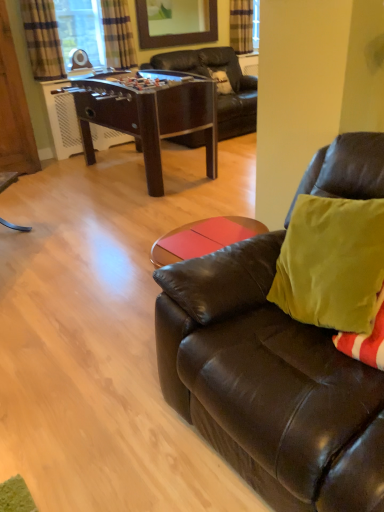
Question: Is wooden frame mirror at upper center facing away from plaid fabric curtain at upper left, which is the 2th curtain in left-to-right order?

Choices:
 (A) yes
 (B) no

Answer: (B)

Question: Is wooden frame mirror at upper center bigger than plaid fabric curtain at upper left, the second curtain from the front?

Choices:
 (A) yes
 (B) no

Answer: (B)

Question: Is wooden frame mirror at upper center touching plaid fabric curtain at upper left, which is the 2th curtain in left-to-right order?

Choices:
 (A) yes
 (B) no

Answer: (B)

Question: Does wooden frame mirror at upper center have a greater width compared to plaid fabric curtain at upper left, the second curtain from the front?

Choices:
 (A) no
 (B) yes

Answer: (A)

Question: Is wooden frame mirror at upper center taller than plaid fabric curtain at upper left, the second curtain from the front?

Choices:
 (A) yes
 (B) no

Answer: (B)

Question: Considering the relative positions of plaid fabric curtain at upper left, positioned as the 3th curtain in right-to-left order, and wooden frame mirror at upper center in the image provided, is plaid fabric curtain at upper left, positioned as the 3th curtain in right-to-left order, to the left or to the right of wooden frame mirror at upper center?

Choices:
 (A) left
 (B) right

Answer: (A)

Question: From the image's perspective, relative to wooden frame mirror at upper center, is plaid fabric curtain at upper left, placed as the first curtain when sorted from front to back, above or below?

Choices:
 (A) above
 (B) below

Answer: (B)

Question: In the image, is plaid fabric curtain at upper left, positioned as the 3th curtain in right-to-left order, positioned in front of or behind wooden frame mirror at upper center?

Choices:
 (A) front
 (B) behind

Answer: (A)

Question: Looking at their shapes, would you say plaid fabric curtain at upper left, positioned as the 1th curtain in left-to-right order, is wider or thinner than wooden frame mirror at upper center?

Choices:
 (A) thin
 (B) wide

Answer: (B)

Question: Based on their positions, is plaid fabric curtain at upper center, which is counted as the third curtain, starting from the left, located to the left or right of plaid fabric curtain at upper left, positioned as the 3th curtain in right-to-left order?

Choices:
 (A) left
 (B) right

Answer: (B)

Question: Is plaid fabric curtain at upper center, the 1th curtain when ordered from right to left, bigger or smaller than plaid fabric curtain at upper left, positioned as the 3th curtain in right-to-left order?

Choices:
 (A) big
 (B) small

Answer: (B)

Question: Considering their positions, is plaid fabric curtain at upper center, the first curtain viewed from the back, located in front of or behind plaid fabric curtain at upper left, the 3th curtain when ordered from back to front?

Choices:
 (A) front
 (B) behind

Answer: (B)

Question: Looking at their shapes, would you say plaid fabric curtain at upper center, which is counted as the third curtain, starting from the left, is wider or thinner than plaid fabric curtain at upper left, placed as the first curtain when sorted from front to back?

Choices:
 (A) wide
 (B) thin

Answer: (B)

Question: Is brown wooden foosball table at center to the left or to the right of wooden frame mirror at upper center in the image?

Choices:
 (A) left
 (B) right

Answer: (A)

Question: From a real-world perspective, relative to wooden frame mirror at upper center, is brown wooden foosball table at center vertically above or below?

Choices:
 (A) above
 (B) below

Answer: (B)